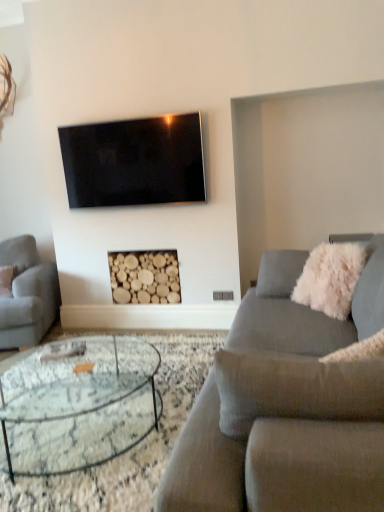
Question: Is the surface of white fluffy pillow at right in direct contact with textured gray couch at center, which is counted as the second studio couch, starting from the back?

Choices:
 (A) yes
 (B) no

Answer: (B)

Question: From the image's perspective, is white fluffy pillow at right located beneath textured gray couch at center, which is counted as the 1th studio couch, starting from the front?

Choices:
 (A) yes
 (B) no

Answer: (B)

Question: From the image's perspective, would you say white fluffy pillow at right is positioned over textured gray couch at center, acting as the 2th studio couch starting from the left?

Choices:
 (A) yes
 (B) no

Answer: (A)

Question: Is white fluffy pillow at right at the right side of textured gray couch at center, acting as the 2th studio couch starting from the left?

Choices:
 (A) no
 (B) yes

Answer: (B)

Question: Can you confirm if white fluffy pillow at right is wider than textured gray couch at center, acting as the 2th studio couch starting from the left?

Choices:
 (A) yes
 (B) no

Answer: (B)

Question: Is the depth of white fluffy pillow at right less than that of textured gray couch at center, which is counted as the second studio couch, starting from the back?

Choices:
 (A) yes
 (B) no

Answer: (B)

Question: From a real-world perspective, is natural wood logs at center located higher than textured gray couch at center, which is counted as the second studio couch, starting from the back?

Choices:
 (A) yes
 (B) no

Answer: (A)

Question: Considering the relative positions of natural wood logs at center and textured gray couch at center, which is counted as the 1th studio couch, starting from the front, in the image provided, is natural wood logs at center behind textured gray couch at center, which is counted as the 1th studio couch, starting from the front,?

Choices:
 (A) yes
 (B) no

Answer: (A)

Question: Could you tell me if natural wood logs at center is facing textured gray couch at center, which is counted as the second studio couch, starting from the back?

Choices:
 (A) yes
 (B) no

Answer: (B)

Question: Is natural wood logs at center at the right side of textured gray couch at center, which is counted as the second studio couch, starting from the back?

Choices:
 (A) no
 (B) yes

Answer: (A)

Question: Would you say natural wood logs at center contains textured gray couch at center, which is counted as the second studio couch, starting from the back?

Choices:
 (A) no
 (B) yes

Answer: (A)

Question: Is natural wood logs at center outside textured gray couch at center, acting as the 2th studio couch starting from the left?

Choices:
 (A) yes
 (B) no

Answer: (A)

Question: Is natural wood logs at center directly adjacent to black glossy tv at upper center?

Choices:
 (A) yes
 (B) no

Answer: (B)